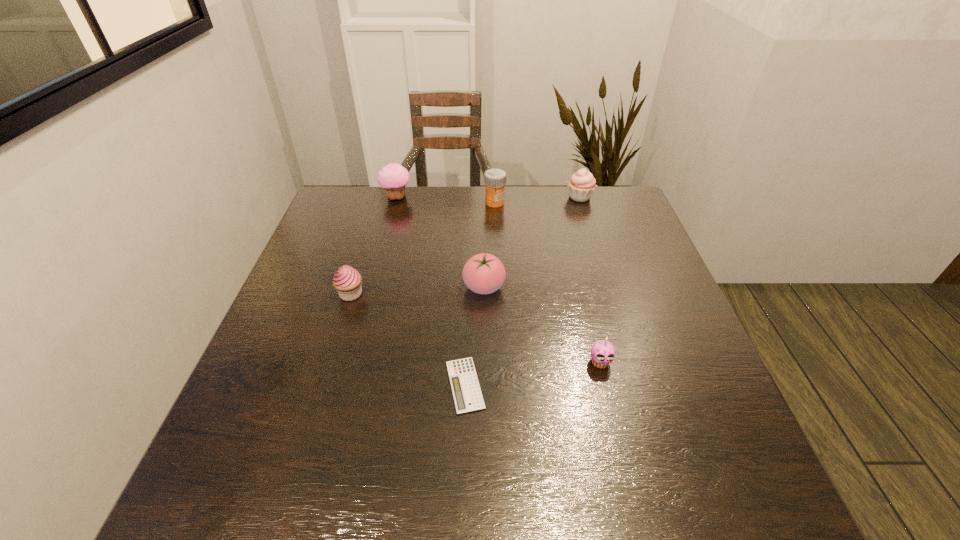
The width and height of the screenshot is (960, 540). In order to click on free space located 0.350m on the back of the calculator in this screenshot , I will do `click(468, 255)`.

Where is `medicine positioned at the far edge`? This screenshot has width=960, height=540. medicine positioned at the far edge is located at coordinates (495, 179).

This screenshot has width=960, height=540. I want to click on object present at the right edge, so click(x=581, y=185).

Locate an element on the screen. This screenshot has width=960, height=540. object that is positioned at the far left corner is located at coordinates (393, 178).

At what (x,y) coordinates should I click in order to perform the action: click on object that is at the far right corner. Please return your answer as a coordinate pair (x, y). Image resolution: width=960 pixels, height=540 pixels. Looking at the image, I should click on (581, 185).

Locate an element on the screen. free location at the far edge is located at coordinates (409, 207).

Where is `vacant space at the near edge`? Image resolution: width=960 pixels, height=540 pixels. vacant space at the near edge is located at coordinates (667, 507).

Identify the location of vacant space at the left edge of the desktop. The width and height of the screenshot is (960, 540). (299, 437).

Find the location of `free space at the right edge of the desktop`. free space at the right edge of the desktop is located at coordinates (646, 315).

In the image, there is a desktop. Find the location of `vacant space at the far left corner`. vacant space at the far left corner is located at coordinates (338, 224).